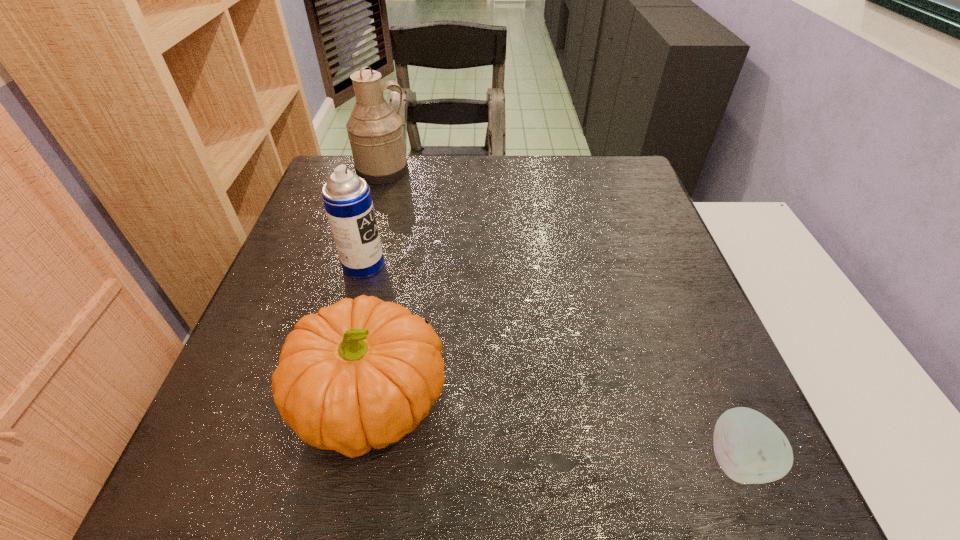
Locate an element on the screen. The image size is (960, 540). vacant point at the left edge is located at coordinates (316, 235).

Locate an element on the screen. The height and width of the screenshot is (540, 960). free region at the right edge of the desktop is located at coordinates (612, 245).

You are a GUI agent. You are given a task and a screenshot of the screen. Output one action in this format:
    pyautogui.click(x=<x>, y=<y>)
    Task: Click on the free space at the near right corner of the desktop
    The image size is (960, 540).
    Given the screenshot: What is the action you would take?
    pyautogui.click(x=698, y=490)

At what (x,y) coordinates should I click in order to perform the action: click on free spot between the shortest object and the aerosol can. Please return your answer as a coordinate pair (x, y). This screenshot has width=960, height=540. Looking at the image, I should click on (550, 362).

The height and width of the screenshot is (540, 960). Identify the location of empty space between the third nearest object and the shortest object. (550, 362).

The height and width of the screenshot is (540, 960). I want to click on vacant space that's between the rightmost object and the pitcher, so click(x=560, y=315).

You are a GUI agent. You are given a task and a screenshot of the screen. Output one action in this format:
    pyautogui.click(x=<x>, y=<y>)
    Task: Click on the empty location between the rightmost object and the pumpkin
    
    Given the screenshot: What is the action you would take?
    pyautogui.click(x=556, y=431)

What are the coordinates of `vacant area that lies between the pitcher and the shortest object` in the screenshot? It's located at (560, 315).

Where is `vacant area between the pumpkin and the apple`? The width and height of the screenshot is (960, 540). vacant area between the pumpkin and the apple is located at coordinates (556, 431).

Where is `the second closest object to the aerosol can`? The width and height of the screenshot is (960, 540). the second closest object to the aerosol can is located at coordinates (375, 132).